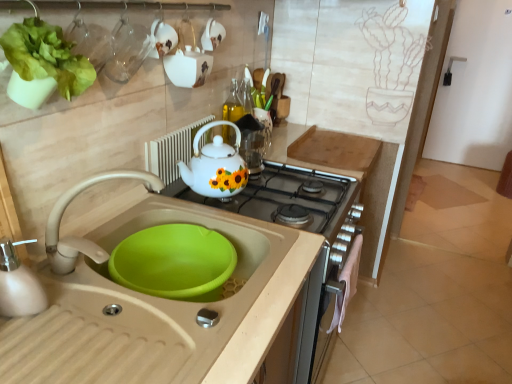
At what (x,y) coordinates should I click in order to perform the action: click on vacant space that is in between matte beige faucet at sink left and white matte soap dispenser at left. Please return your answer as a coordinate pair (x, y). Looking at the image, I should click on (88, 306).